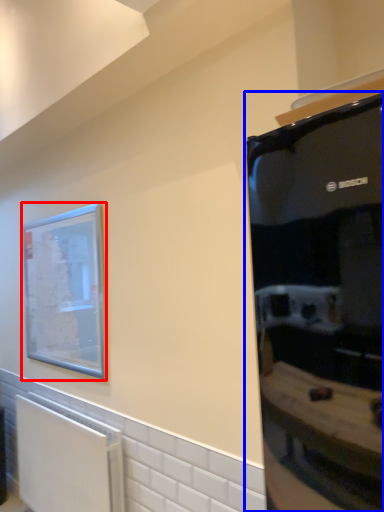
Question: Which of the following is the farthest to the observer, picture frame (highlighted by a red box) or appliance (highlighted by a blue box)?

Choices:
 (A) picture frame
 (B) appliance

Answer: (A)